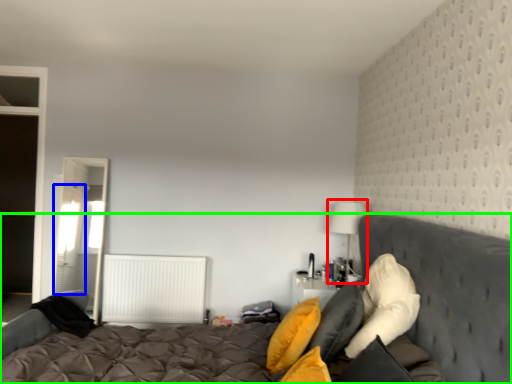
Question: Which is nearer to the table lamp (highlighted by a red box)? curtain (highlighted by a blue box) or bed (highlighted by a green box).

Choices:
 (A) curtain
 (B) bed

Answer: (B)